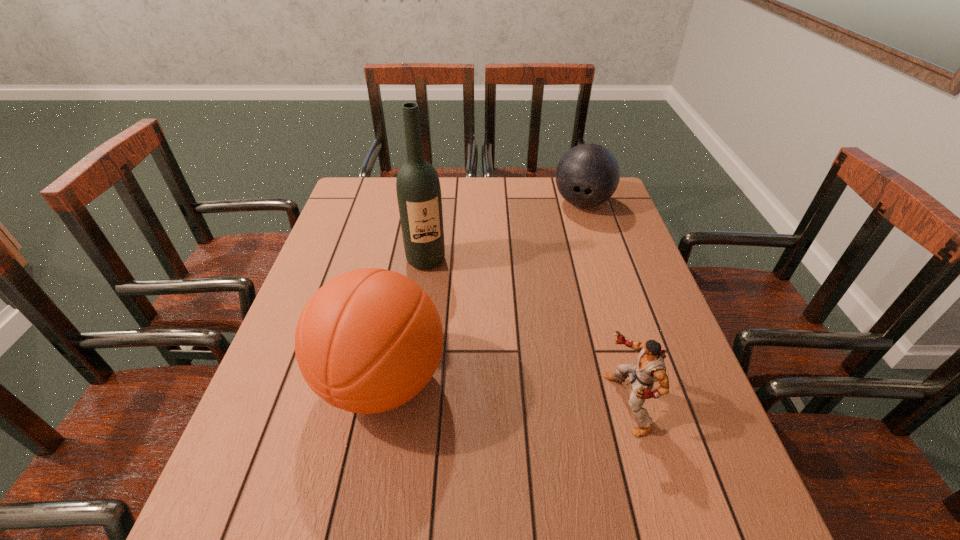
Identify which object is the nearest to the tallest object. Please provide its 2D coordinates. Your answer should be formatted as a tuple, i.e. [(x, y)], where the tuple contains the x and y coordinates of a point satisfying the conditions above.

[(369, 340)]

At what (x,y) coordinates should I click in order to perform the action: click on blank space that satisfies the following two spatial constraints: 1. on the back side of the farthest object; 2. on the left side of the second tallest object. Please return your answer as a coordinate pair (x, y). The height and width of the screenshot is (540, 960). Looking at the image, I should click on (417, 202).

You are a GUI agent. You are given a task and a screenshot of the screen. Output one action in this format:
    pyautogui.click(x=<x>, y=<y>)
    Task: Click on the blank space that satisfies the following two spatial constraints: 1. on the front side of the second tallest object; 2. on the front-facing side of the puncher
    This screenshot has height=540, width=960.
    Given the screenshot: What is the action you would take?
    [x=377, y=403]